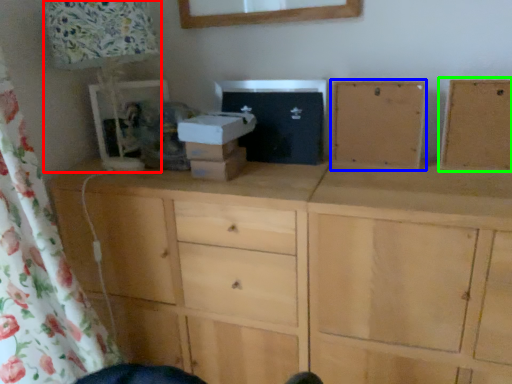
Question: Considering the real-world distances, which object is closest to table lamp (highlighted by a red box)? cabinetry (highlighted by a blue box) or cabinetry (highlighted by a green box).

Choices:
 (A) cabinetry
 (B) cabinetry

Answer: (A)